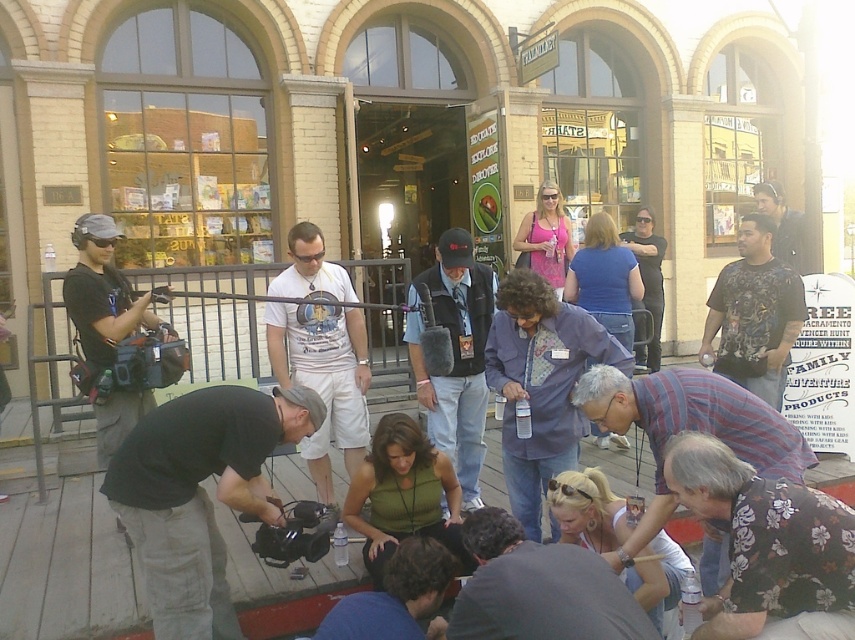
You are standing at the point labeled point (x=658, y=236) and want to walk towards the building entrance. There is a person at point (x=525, y=577). Will this person be in your direct path to the building entrance?

Yes, the person at point (x=525, y=577) will be in your direct path because they are positioned in front of your current location at point (x=658, y=236), meaning they are closer to the building entrance.

You are a photographer trying to set up your equipment. You have a black matte camera at lower left and a matte black shirt at center. Which object is closer to you in the scene?

The black matte camera at lower left is closer to you because it is in front of the matte black shirt at center.

You are standing at the point with coordinates point (x=199, y=493). What object are you standing on?

You are standing on the black matte camera at lower left.